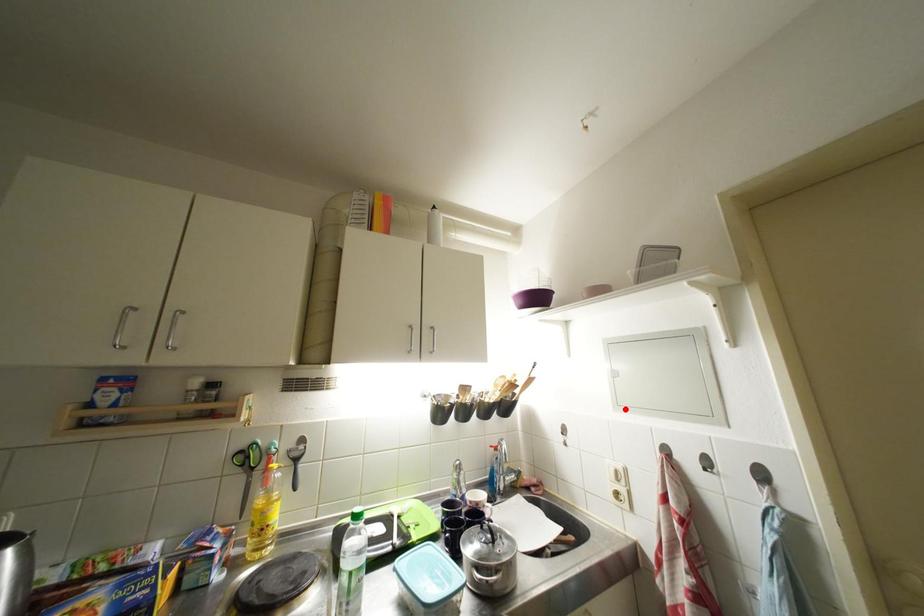
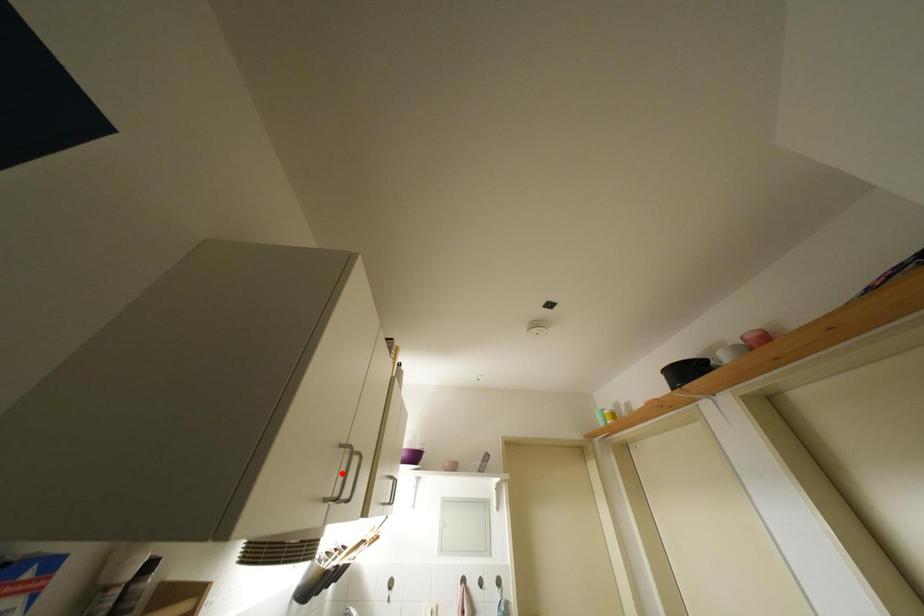
I am providing you with two images of the same scene from different viewpoints. A red point is marked on the first image and another point is marked on the second image. Is the marked point in image1 the same physical position as the marked point in image2?

No